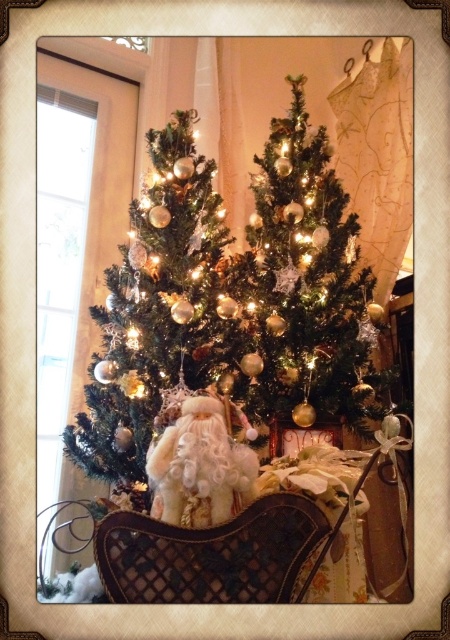
You are a child trying to reach both the shiny gold ornaments at left and the shiny gold ornaments at center on the Christmas tree. If your arms can only reach up to 7 inches, can you grab both of them?

The shiny gold ornaments at left is 7.45 inches away from shiny gold ornaments at center. Since your arms can only reach up to 7 inches, you cannot grab both of them as the distance between them exceeds your reach.

Based on the scene description, where are the shiny gold ornaments at left located in terms of their 2D coordinates?

The shiny gold ornaments at left are located at the 2D coordinates of point (161, 339).

You are standing in front of the Christmas tree and want to place a new decoration. Where exactly should you place the shiny gold ornaments at left relative to the tree?

The shiny gold ornaments at left should be placed at the coordinates (161, 339) relative to the tree.